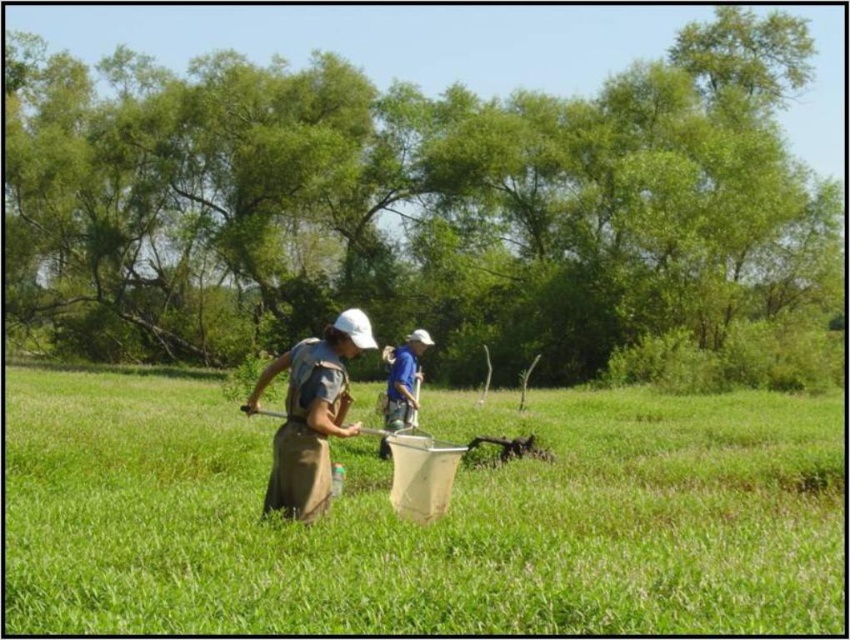
Question: Which of these objects is positioned farthest from the metallic silver shovel at center?

Choices:
 (A) brown canvas apron at center
 (B) green grass at center

Answer: (B)

Question: Which object is positioned farthest from the green grass at center?

Choices:
 (A) brown canvas apron at center
 (B) metallic silver shovel at center

Answer: (A)

Question: Is green grass at center to the right of blue fabric shirt at center from the viewer's perspective?

Choices:
 (A) no
 (B) yes

Answer: (B)

Question: Which of the following is the closest to the observer?

Choices:
 (A) (536, 451)
 (B) (350, 346)
 (C) (401, 428)

Answer: (B)

Question: Does blue fabric shirt at center appear on the left side of metallic silver shovel at center?

Choices:
 (A) no
 (B) yes

Answer: (A)

Question: Can you confirm if brown canvas apron at center is positioned to the left of metallic silver shovel at center?

Choices:
 (A) no
 (B) yes

Answer: (B)